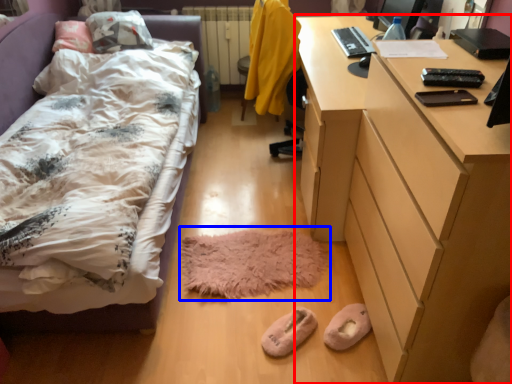
Question: Which point is closer to the camera, desk (highlighted by a red box) or mat (highlighted by a blue box)?

Choices:
 (A) desk
 (B) mat

Answer: (A)